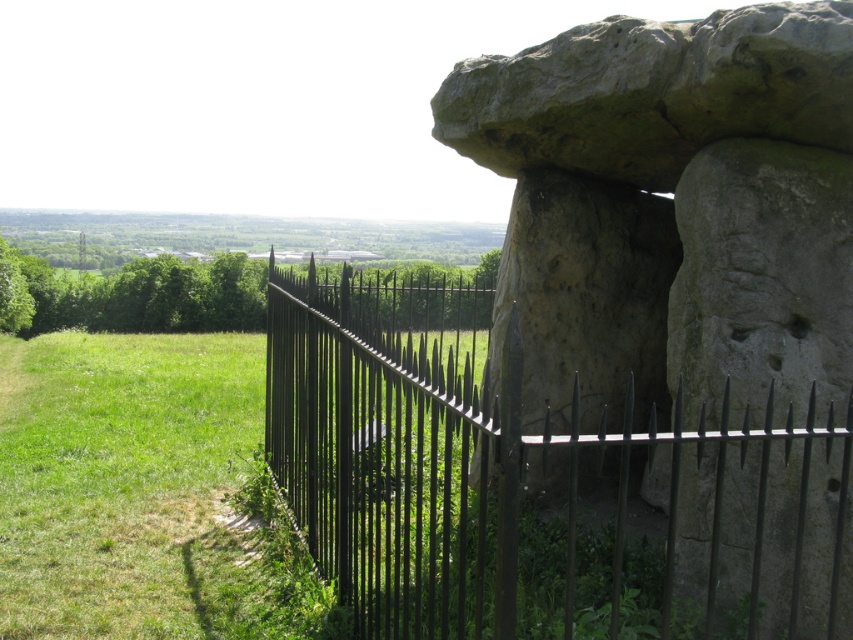
Describe the element at coordinates (672, 209) in the screenshot. The width and height of the screenshot is (853, 640). I see `gray stone structure at center` at that location.

Locate an element on the screen. The width and height of the screenshot is (853, 640). gray stone structure at center is located at coordinates (672, 209).